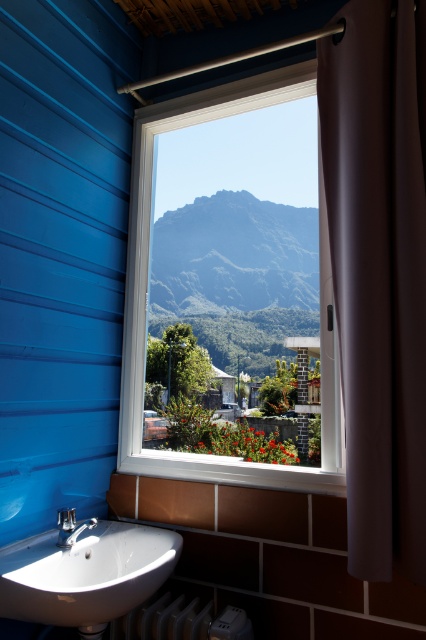
Describe the element at coordinates (147, 275) in the screenshot. I see `white plastic window at center` at that location.

Can you confirm if white plastic window at center is positioned below white glossy sink at lower left?

Actually, white plastic window at center is above white glossy sink at lower left.

Does point (123, 401) come behind point (95, 625)?

Yes, it is.

Where is `white plastic window at center`? Image resolution: width=426 pixels, height=640 pixels. white plastic window at center is located at coordinates (147, 275).

Consider the image. How far apart are brown fabric curtain at right and white glossy sink at lower left?

brown fabric curtain at right and white glossy sink at lower left are 86.96 centimeters apart.

Between brown fabric curtain at right and white glossy sink at lower left, which one has less height?

white glossy sink at lower left

Between point (409, 426) and point (123, 604), which one is positioned behind?

The point (409, 426) is more distant.

You are a GUI agent. You are given a task and a screenshot of the screen. Output one action in this format:
    pyautogui.click(x=<x>, y=<y>)
    Task: Click on the brown fabric curtain at right
    
    Given the screenshot: What is the action you would take?
    pyautogui.click(x=379, y=273)

Which is more to the right, green textured mountain at center or white plastic radiator at lower center?

green textured mountain at center is more to the right.

Who is higher up, green textured mountain at center or white plastic radiator at lower center?

green textured mountain at center is above.

Which is in front, point (308, 292) or point (115, 627)?

Positioned in front is point (115, 627).

Locate an element on the screen. green textured mountain at center is located at coordinates tap(236, 275).